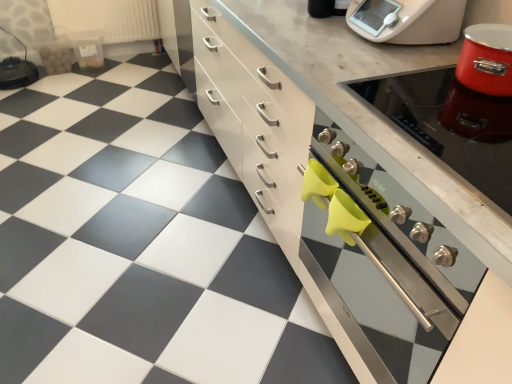
Question: Is white plastic food processor at upper right to the right of matte white cabinet at center from the viewer's perspective?

Choices:
 (A) yes
 (B) no

Answer: (A)

Question: Is white plastic food processor at upper right closer to the viewer compared to matte white cabinet at center?

Choices:
 (A) yes
 (B) no

Answer: (B)

Question: Considering the relative positions of white plastic food processor at upper right and matte white cabinet at center in the image provided, is white plastic food processor at upper right to the left of matte white cabinet at center from the viewer's perspective?

Choices:
 (A) yes
 (B) no

Answer: (B)

Question: Would you consider white plastic food processor at upper right to be distant from matte white cabinet at center?

Choices:
 (A) yes
 (B) no

Answer: (B)

Question: Is white plastic food processor at upper right surrounding matte white cabinet at center?

Choices:
 (A) yes
 (B) no

Answer: (B)

Question: Based on their sizes in the image, would you say shiny metallic stove at upper right is bigger or smaller than white plastic food processor at upper right?

Choices:
 (A) small
 (B) big

Answer: (A)

Question: Is shiny metallic stove at upper right taller or shorter than white plastic food processor at upper right?

Choices:
 (A) tall
 (B) short

Answer: (B)

Question: Relative to white plastic food processor at upper right, is shiny metallic stove at upper right in front or behind?

Choices:
 (A) behind
 (B) front

Answer: (B)

Question: Would you say shiny metallic stove at upper right is to the left or to the right of white plastic food processor at upper right in the picture?

Choices:
 (A) left
 (B) right

Answer: (B)

Question: Looking at their shapes, would you say white plastic radiator at upper left is wider or thinner than metallic silver oven at right?

Choices:
 (A) thin
 (B) wide

Answer: (A)

Question: From their relative heights in the image, would you say white plastic radiator at upper left is taller or shorter than metallic silver oven at right?

Choices:
 (A) tall
 (B) short

Answer: (B)

Question: From the image's perspective, is white plastic radiator at upper left located above or below metallic silver oven at right?

Choices:
 (A) above
 (B) below

Answer: (A)

Question: Considering the positions of point (94, 29) and point (330, 134), is point (94, 29) closer or farther from the camera than point (330, 134)?

Choices:
 (A) closer
 (B) farther

Answer: (B)

Question: From a real-world perspective, is matte white cabinet at center above or below white plastic radiator at upper left?

Choices:
 (A) above
 (B) below

Answer: (A)

Question: Considering their positions, is matte white cabinet at center located in front of or behind white plastic radiator at upper left?

Choices:
 (A) behind
 (B) front

Answer: (B)